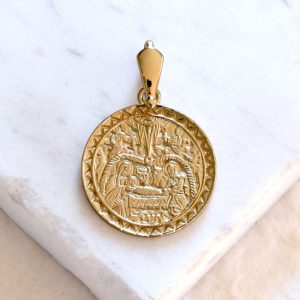
Where is `hook`? This screenshot has width=300, height=300. hook is located at coordinates (141, 98).